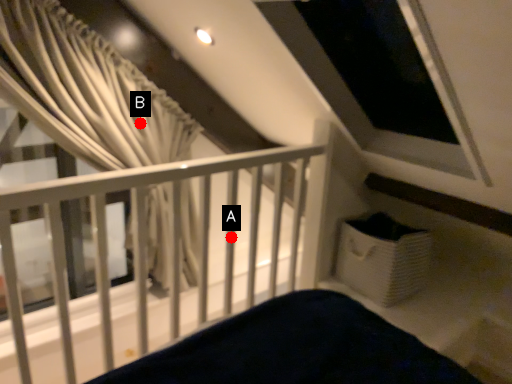
Question: Two points are circled on the image, labeled by A and B beside each circle. Which point is closer to the camera taking this photo?

Choices:
 (A) A is closer
 (B) B is closer

Answer: (A)